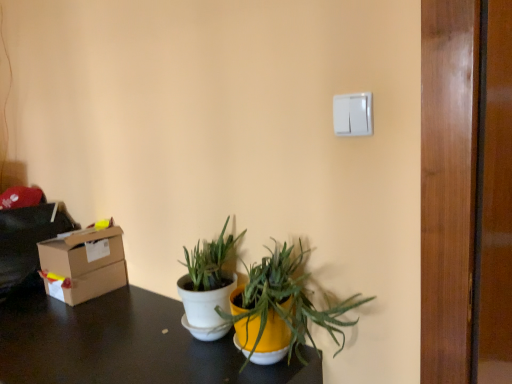
Question: Should I look upward or downward to see white matte pot at center, the second houseplant in the left-to-right sequence?

Choices:
 (A) up
 (B) down

Answer: (B)

Question: Considering the relative sizes of white matte pot at center, arranged as the 1th houseplant when viewed from the right, and white matte pot at center, the first houseplant when ordered from left to right, in the image provided, is white matte pot at center, arranged as the 1th houseplant when viewed from the right, thinner than white matte pot at center, the first houseplant when ordered from left to right,?

Choices:
 (A) no
 (B) yes

Answer: (A)

Question: Is white matte pot at center, arranged as the 1th houseplant when viewed from the right, to the left of white matte pot at center, the first houseplant when ordered from left to right, from the viewer's perspective?

Choices:
 (A) yes
 (B) no

Answer: (B)

Question: Does white matte pot at center, arranged as the 1th houseplant when viewed from the right, have a greater height compared to white matte pot at center, the first houseplant when ordered from left to right?

Choices:
 (A) no
 (B) yes

Answer: (A)

Question: Does white matte pot at center, the second houseplant in the left-to-right sequence, lie in front of white matte pot at center, the first houseplant when ordered from left to right?

Choices:
 (A) no
 (B) yes

Answer: (B)

Question: From the image's perspective, is white matte pot at center, the second houseplant in the left-to-right sequence, on white matte pot at center, the 2th houseplant in the right-to-left sequence?

Choices:
 (A) yes
 (B) no

Answer: (A)

Question: Is white matte pot at center, arranged as the 1th houseplant when viewed from the right, bigger than white matte pot at center, the first houseplant when ordered from left to right?

Choices:
 (A) no
 (B) yes

Answer: (B)

Question: Is white matte pot at center, the first houseplant when ordered from left to right, looking in the opposite direction of white matte pot at center, arranged as the 1th houseplant when viewed from the right?

Choices:
 (A) yes
 (B) no

Answer: (B)

Question: Is white matte pot at center, the 2th houseplant in the right-to-left sequence, in front of white matte pot at center, arranged as the 1th houseplant when viewed from the right?

Choices:
 (A) yes
 (B) no

Answer: (B)

Question: Does white matte pot at center, the first houseplant when ordered from left to right, have a larger size compared to white matte pot at center, the second houseplant in the left-to-right sequence?

Choices:
 (A) yes
 (B) no

Answer: (B)

Question: From the image's perspective, would you say white matte pot at center, the 2th houseplant in the right-to-left sequence, is shown under white matte pot at center, the second houseplant in the left-to-right sequence?

Choices:
 (A) yes
 (B) no

Answer: (A)

Question: Can white matte pot at center, the second houseplant in the left-to-right sequence, be found inside white matte pot at center, the first houseplant when ordered from left to right?

Choices:
 (A) no
 (B) yes

Answer: (A)

Question: Is cardboard box at left at the left side of white matte pot at center, the first houseplant when ordered from left to right?

Choices:
 (A) yes
 (B) no

Answer: (A)